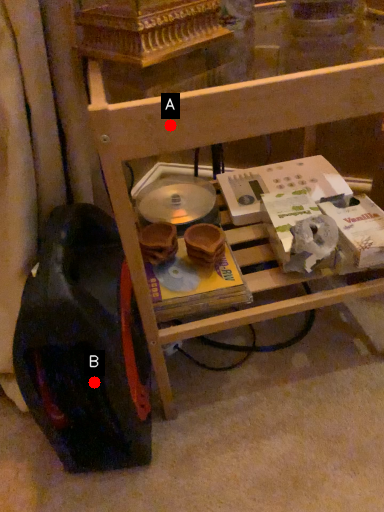
Question: Two points are circled on the image, labeled by A and B beside each circle. Which of the following is the farthest from the observer?

Choices:
 (A) A is further
 (B) B is further

Answer: (B)